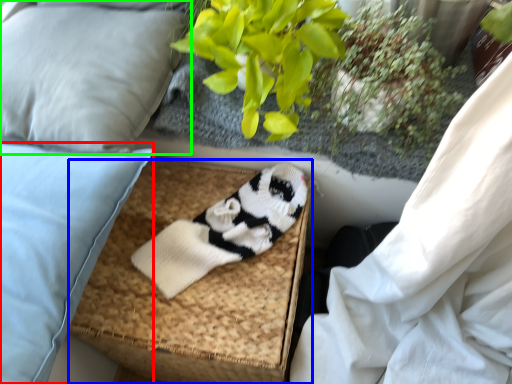
Question: Which is farther away from pillow (highlighted by a red box)? footrest (highlighted by a blue box) or pillow (highlighted by a green box)?

Choices:
 (A) footrest
 (B) pillow

Answer: (A)